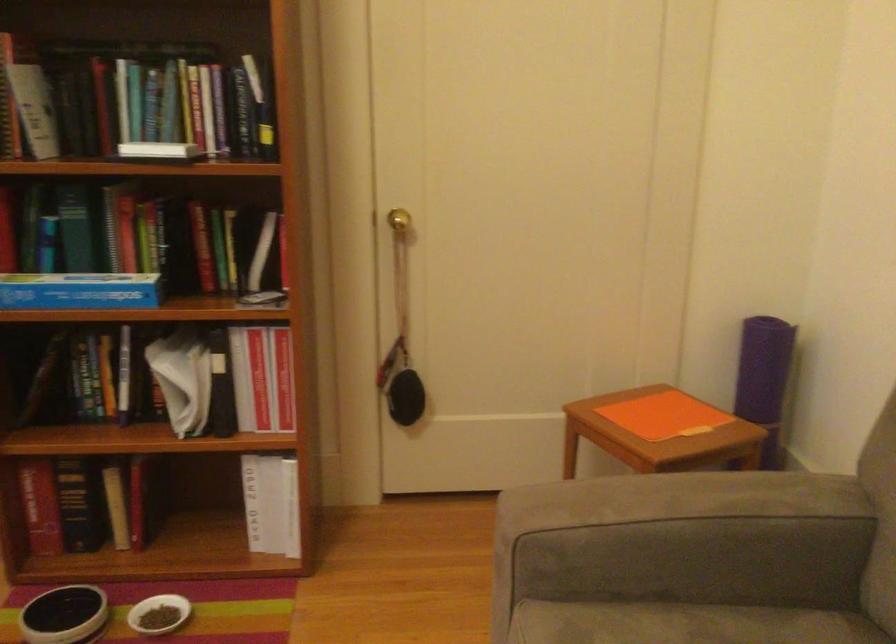
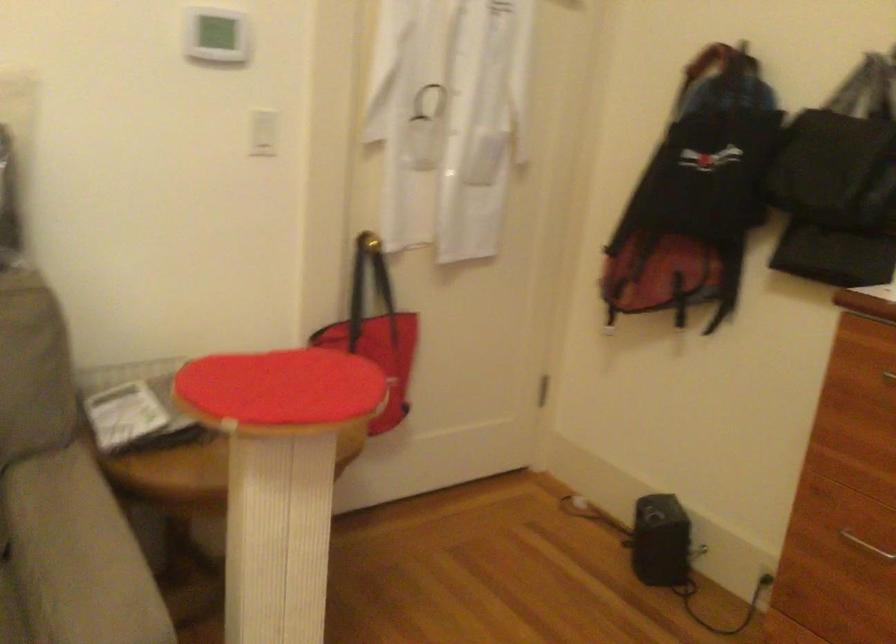
First-person continuous shooting, in which direction is the camera rotating?

The rotation direction of the camera is right-down.